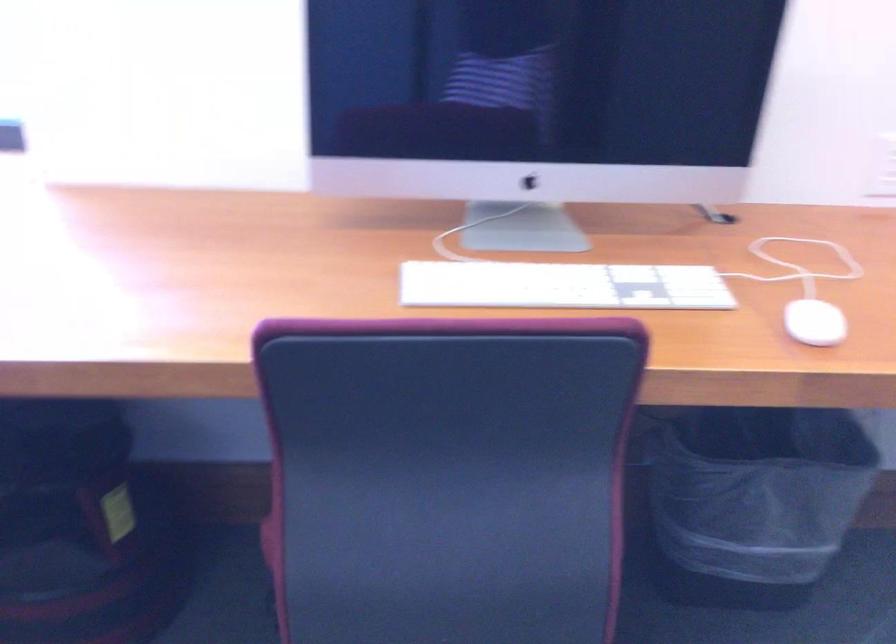
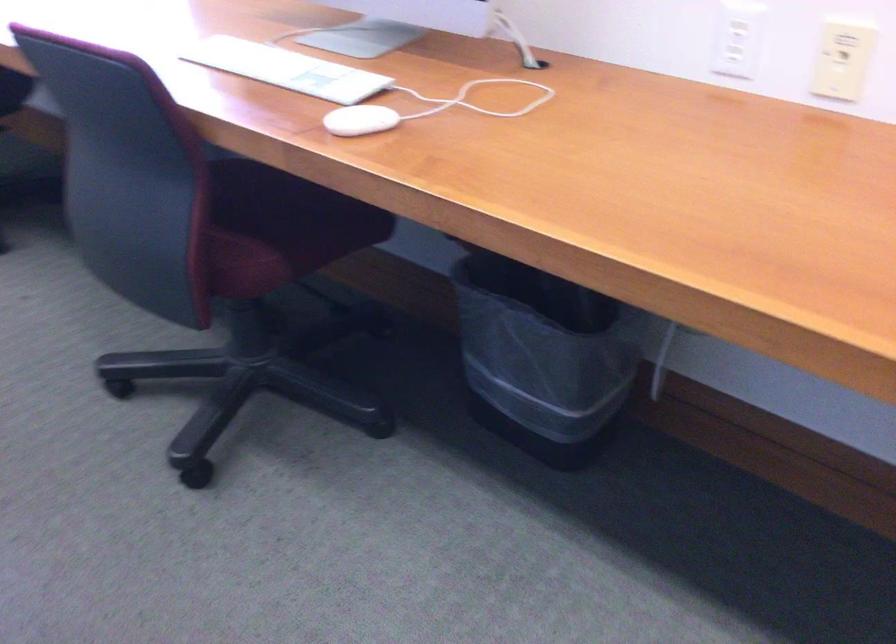
The point at (556, 482) is marked in the first image. Where is the corresponding point in the second image?

(273, 228)